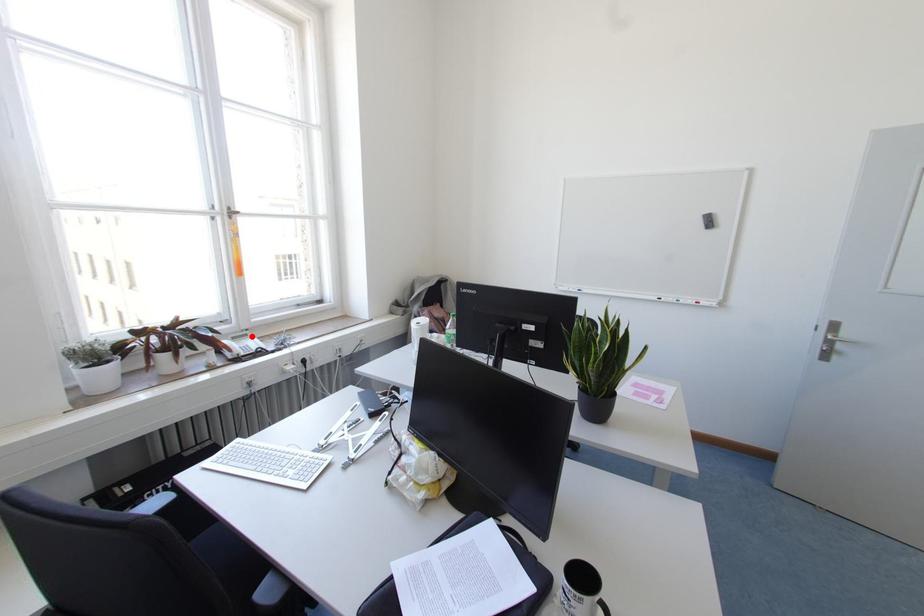
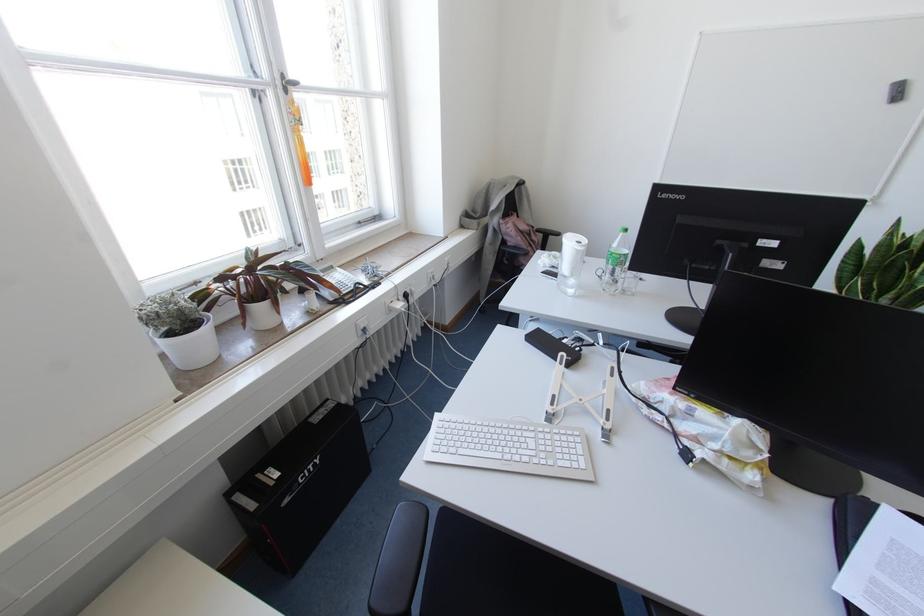
Find the pixel in the second image that matches the highlighted location in the first image.

(336, 268)